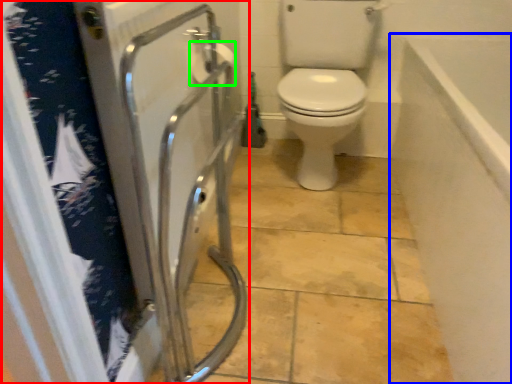
Question: Which object is positioned closest to screen door (highlighted by a red box)? Select from bath (highlighted by a blue box) and toilet paper (highlighted by a green box).

Choices:
 (A) bath
 (B) toilet paper

Answer: (B)